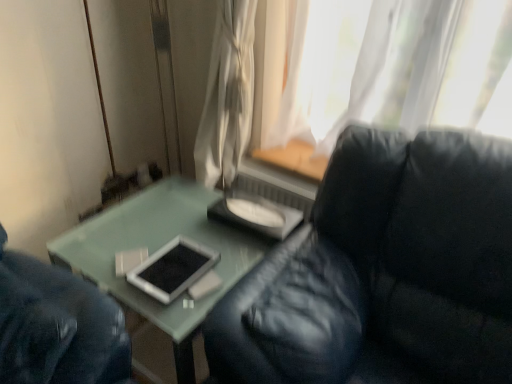
Question: Does point (237, 117) appear closer or farther from the camera than point (477, 312)?

Choices:
 (A) farther
 (B) closer

Answer: (A)

Question: In the image, is white sheer curtain at upper center on the left side or the right side of black leather couch at center?

Choices:
 (A) right
 (B) left

Answer: (B)

Question: Is white sheer curtain at upper center wider or thinner than black leather couch at center?

Choices:
 (A) thin
 (B) wide

Answer: (A)

Question: From the image's perspective, is black leather couch at center located above or below white sheer curtain at upper center?

Choices:
 (A) below
 (B) above

Answer: (A)

Question: Visually, is black leather couch at center positioned to the left or to the right of white sheer curtain at upper center?

Choices:
 (A) left
 (B) right

Answer: (B)

Question: Is black leather couch at center in front of or behind white sheer curtain at upper center in the image?

Choices:
 (A) behind
 (B) front

Answer: (B)

Question: Considering the positions of black leather couch at center and white sheer curtain at upper center in the image, is black leather couch at center wider or thinner than white sheer curtain at upper center?

Choices:
 (A) wide
 (B) thin

Answer: (A)